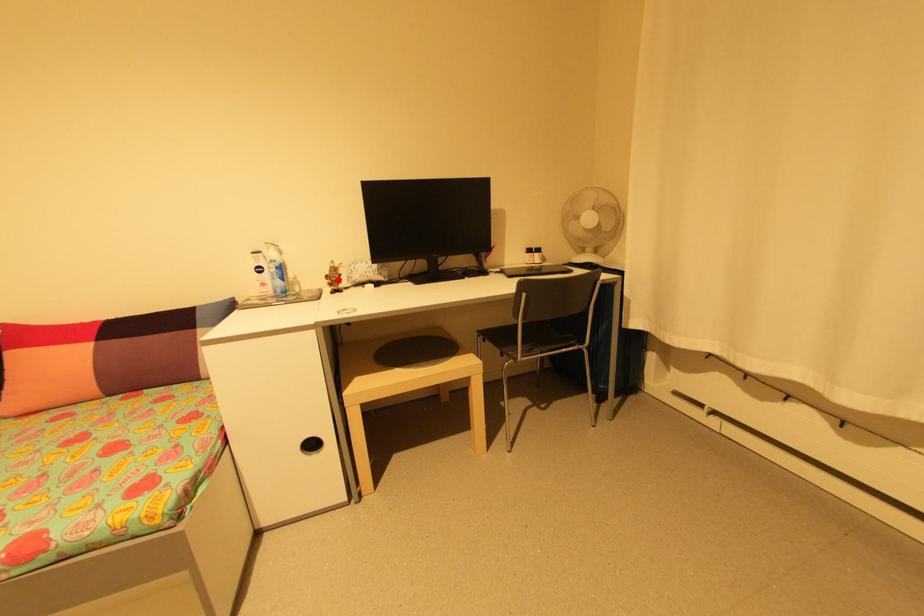
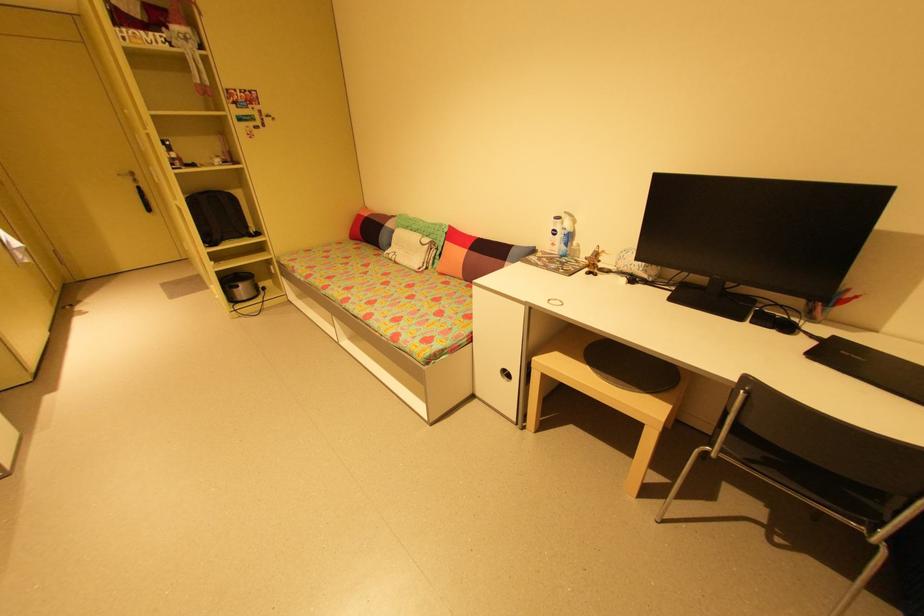
Find the pixel in the second image that matches the highlighted location in the first image.

(597, 262)